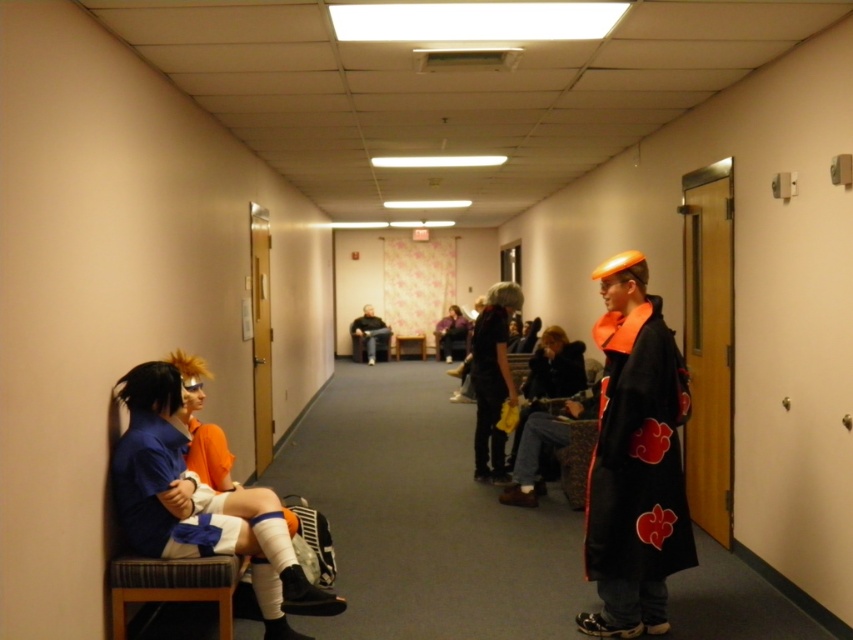
Who is more forward, (665, 554) or (486, 355)?

Point (665, 554)

Between black matte cape at right and black fabric purse at center, which one has more height?

Standing taller between the two is black fabric purse at center.

Where is `black matte cape at right`? black matte cape at right is located at coordinates (637, 452).

Is black matte cape at right wider than dark brown leather jacket at center?

No, black matte cape at right is not wider than dark brown leather jacket at center.

Which is below, black matte cape at right or dark brown leather jacket at center?

dark brown leather jacket at center is below.

Find the location of `black matte cape at right`. black matte cape at right is located at coordinates (637, 452).

Can you confirm if matte blue shirt at left is positioned to the right of black matte cape at right?

No, matte blue shirt at left is not to the right of black matte cape at right.

Is matte blue shirt at left shorter than black matte cape at right?

In fact, matte blue shirt at left may be taller than black matte cape at right.

Where is `matte blue shirt at left`? This screenshot has height=640, width=853. matte blue shirt at left is located at coordinates (201, 497).